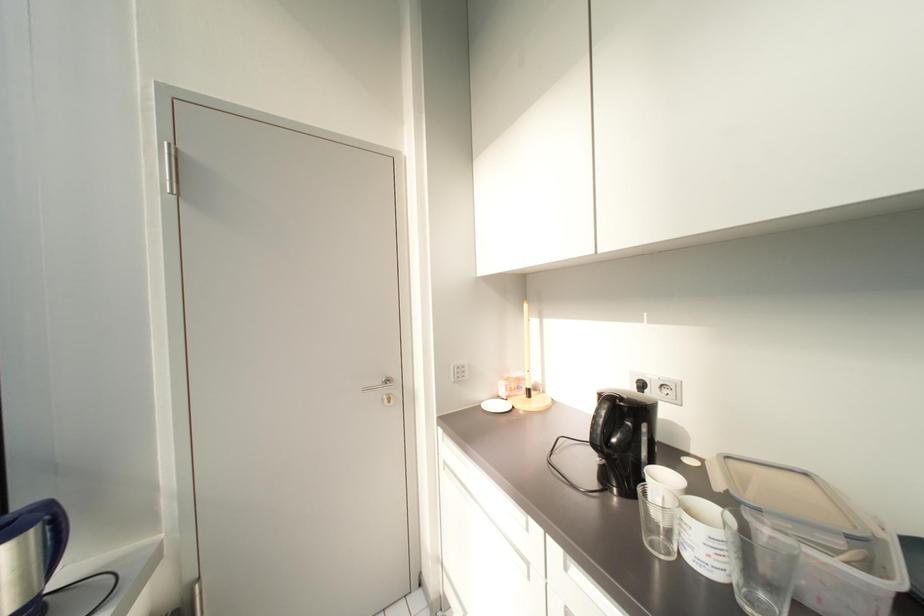
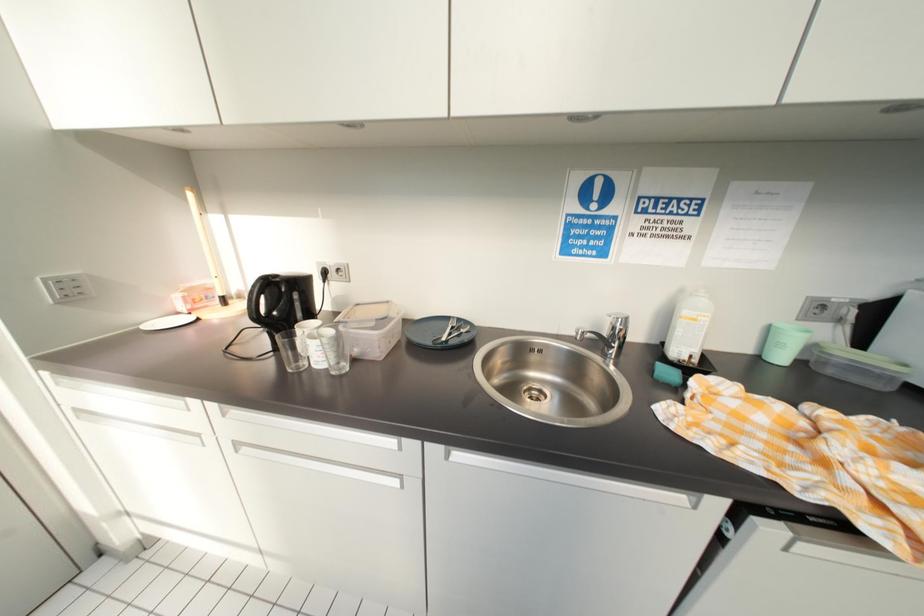
How did the camera likely rotate?

The camera rotated toward right-down.